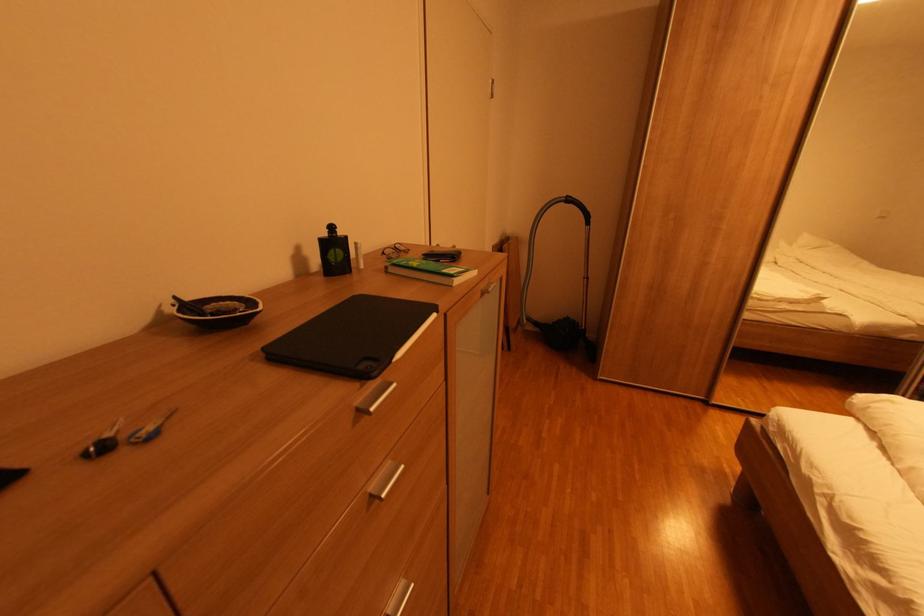
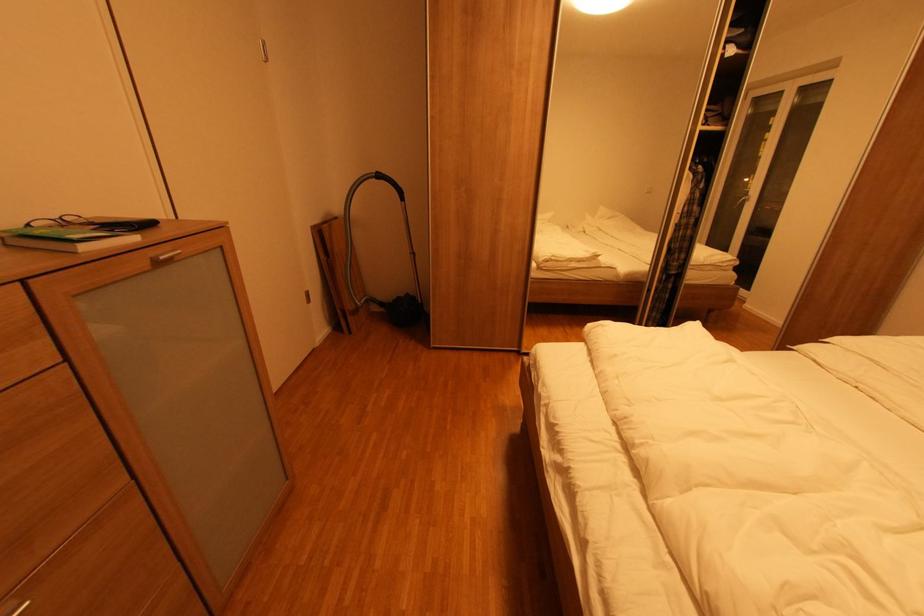
The point at (390, 254) is marked in the first image. Where is the corresponding point in the second image?

(35, 225)